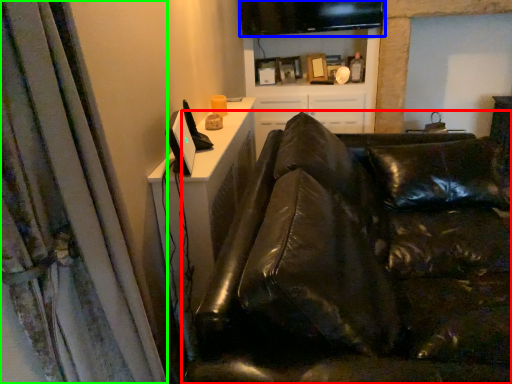
Question: Considering the real-world distances, which object is closest to studio couch (highlighted by a red box)? computer monitor (highlighted by a blue box) or curtain (highlighted by a green box).

Choices:
 (A) computer monitor
 (B) curtain

Answer: (B)